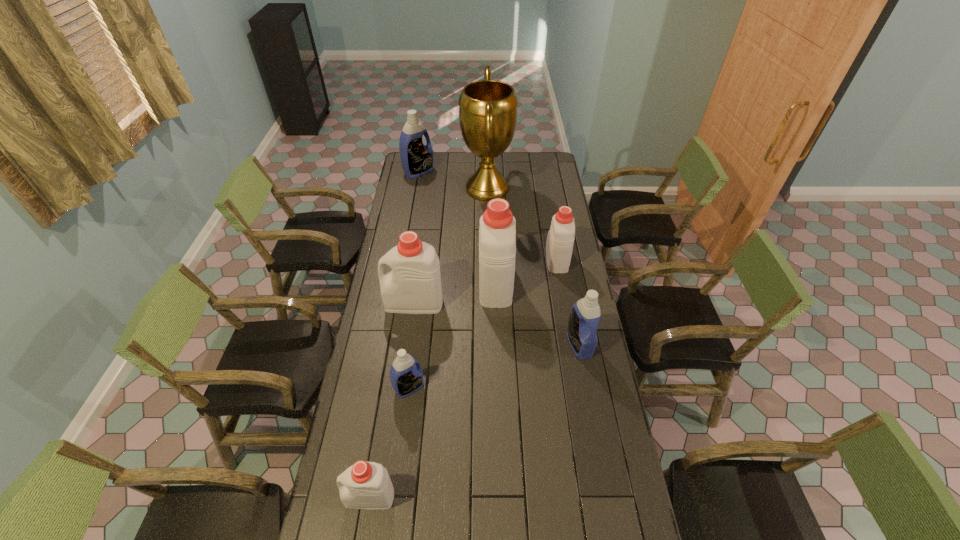
Find the location of a particular element. The width and height of the screenshot is (960, 540). the second nearest detergent is located at coordinates (406, 378).

Image resolution: width=960 pixels, height=540 pixels. In order to click on the nearest blue detergent in this screenshot , I will do `click(406, 378)`.

The width and height of the screenshot is (960, 540). In order to click on the nearest detergent in this screenshot , I will do `click(365, 485)`.

Where is `the nearest object`? Image resolution: width=960 pixels, height=540 pixels. the nearest object is located at coordinates (365, 485).

Locate an element on the screen. The width and height of the screenshot is (960, 540). vacant space located 0.220m on the surface of the trophy cup with symbols is located at coordinates (422, 188).

Locate an element on the screen. The image size is (960, 540). free location located on the surface of the trophy cup with symbols is located at coordinates (400, 188).

Where is `blank space located on the surface of the trophy cup with symbols`? This screenshot has width=960, height=540. blank space located on the surface of the trophy cup with symbols is located at coordinates (427, 188).

In order to click on free location located 0.330m on the handle side of the second tallest object in this screenshot , I will do `click(493, 216)`.

Locate an element on the screen. This screenshot has height=540, width=960. vacant space positioned 0.230m on the handle side of the second tallest object is located at coordinates (493, 228).

Image resolution: width=960 pixels, height=540 pixels. In order to click on free space located on the handle side of the second tallest object in this screenshot , I will do `click(493, 239)`.